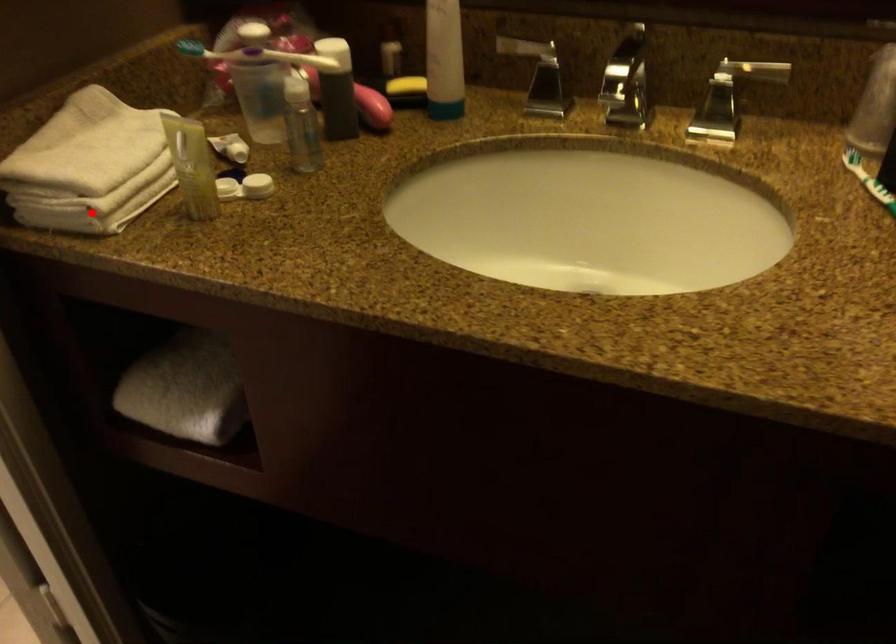
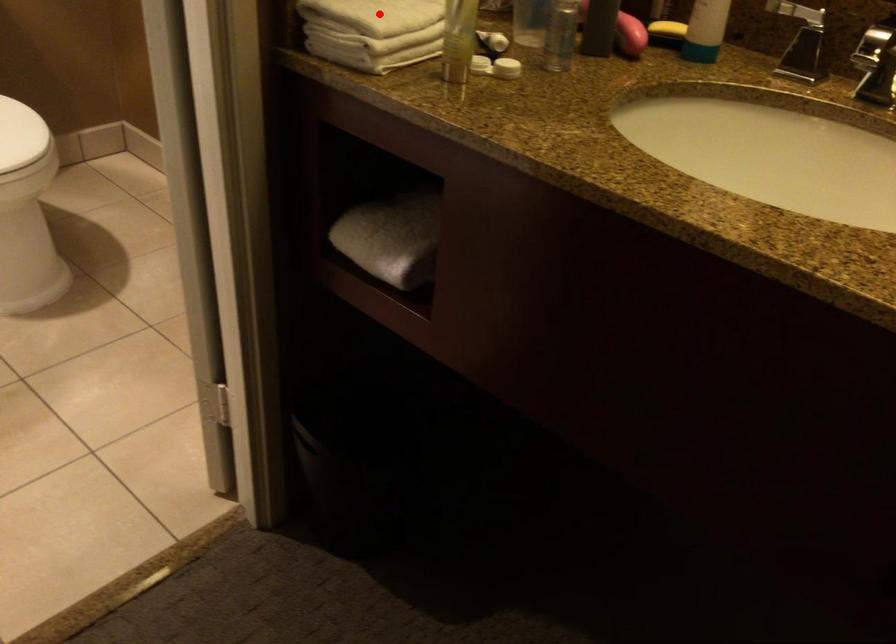
I am providing you with two images of the same scene from different viewpoints. A red point is marked on the first image and another point is marked on the second image. Does the point marked in image1 correspond to the same location as the one in image2?

No